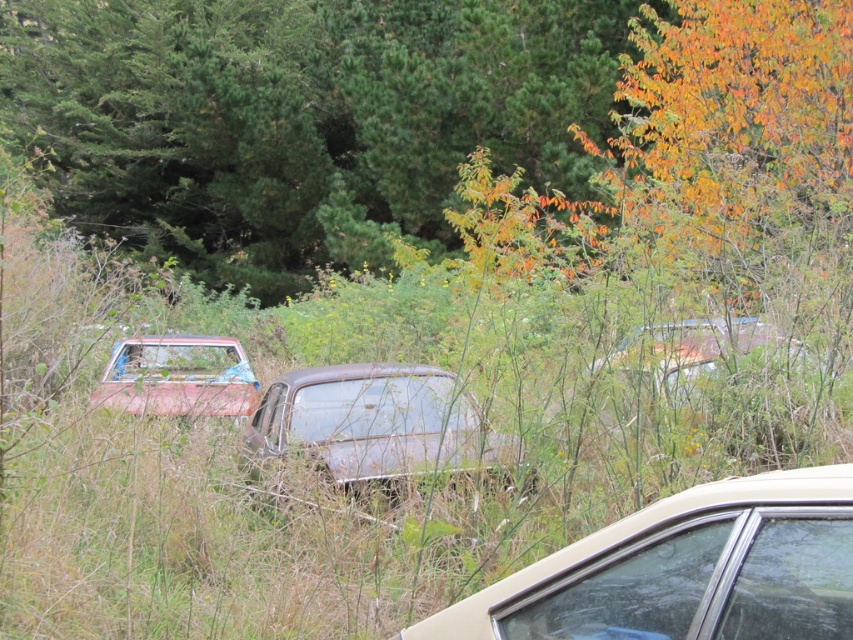
Which is more to the right, green matte tree at upper center or metallic beige sedan at lower right?

metallic beige sedan at lower right is more to the right.

Does green matte tree at upper center come in front of metallic beige sedan at lower right?

That is False.

Identify the location of green matte tree at upper center. The width and height of the screenshot is (853, 640). (300, 116).

Measure the distance from metallic beige sedan at lower right to rusty metallic car at center.

metallic beige sedan at lower right and rusty metallic car at center are 2.94 meters apart.

Is metallic beige sedan at lower right bigger than rusty metallic car at center?

No, metallic beige sedan at lower right is not bigger than rusty metallic car at center.

Is point (737, 637) behind point (323, 394)?

No, it is not.

This screenshot has width=853, height=640. I want to click on metallic beige sedan at lower right, so click(x=686, y=570).

Is green matte tree at upper center positioned before rusty metal car at left?

No, green matte tree at upper center is behind rusty metal car at left.

Is green matte tree at upper center thinner than rusty metal car at left?

No.

In order to click on green matte tree at upper center in this screenshot , I will do `click(300, 116)`.